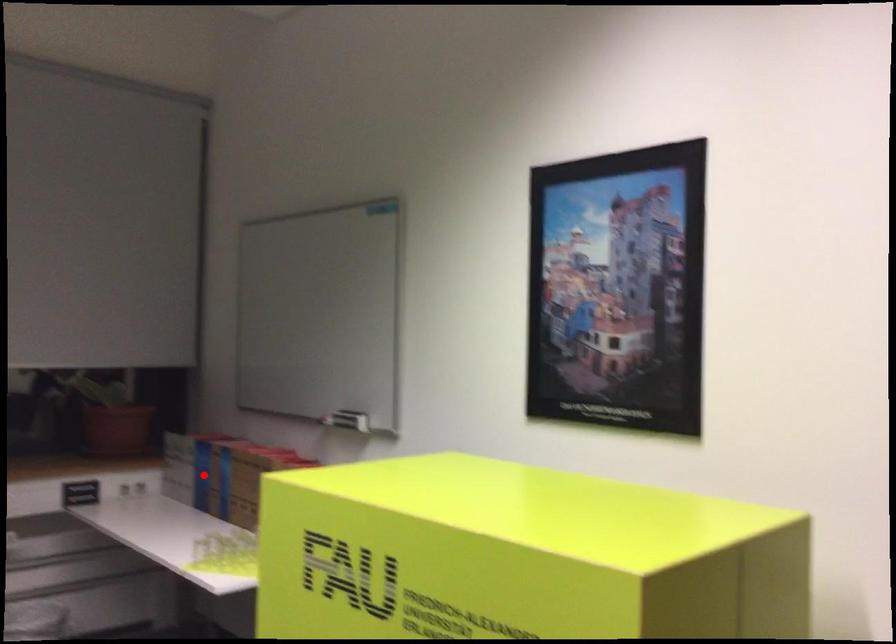
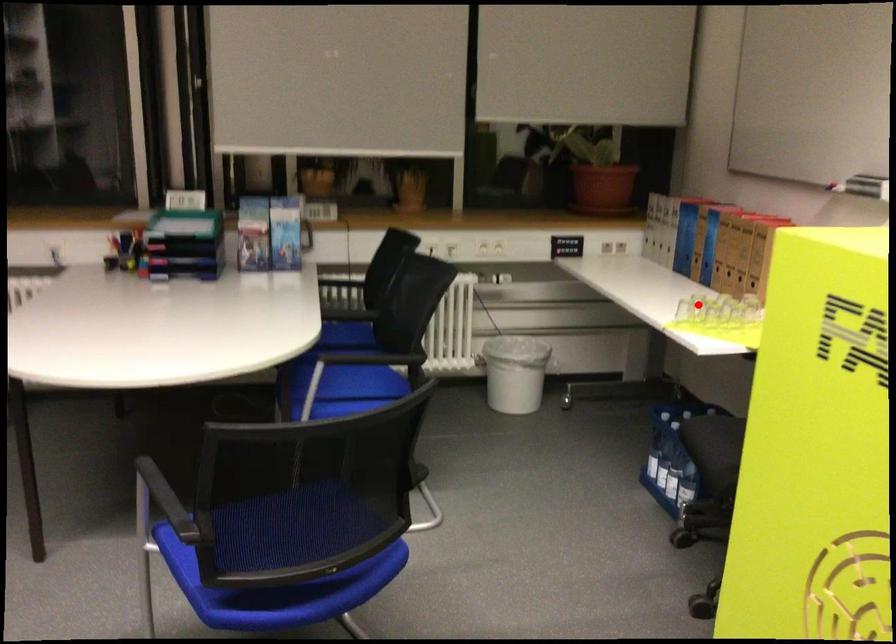
I am providing you with two images of the same scene from different viewpoints. A red point is marked on the first image and another point is marked on the second image. Is the marked point in image1 the same physical position as the marked point in image2?

No